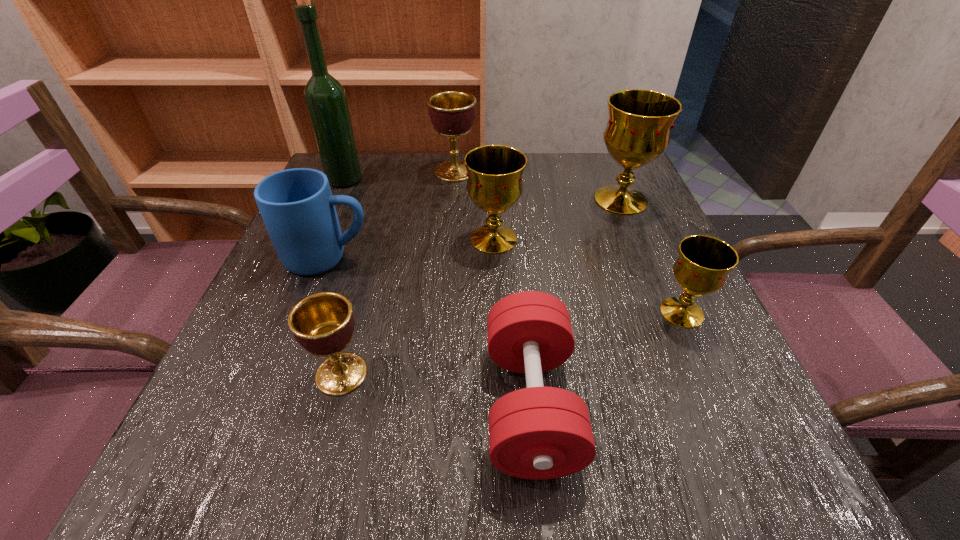
Locate an element on the screen. The height and width of the screenshot is (540, 960). the fourth farthest chalice is located at coordinates (703, 264).

The image size is (960, 540). Identify the location of the left golden chalice. (322, 323).

Image resolution: width=960 pixels, height=540 pixels. Find the location of `the nearer golden chalice`. the nearer golden chalice is located at coordinates (322, 323).

This screenshot has width=960, height=540. Identify the location of dumbbell. (537, 433).

Where is `free space located on the front of the tallest object`? The width and height of the screenshot is (960, 540). free space located on the front of the tallest object is located at coordinates (333, 206).

Locate an element on the screen. The image size is (960, 540). vacant area located on the left of the seventh shortest object is located at coordinates click(537, 200).

At what (x,y) coordinates should I click in order to perform the action: click on vacant region located on the right of the farthest chalice. Please return your answer as a coordinate pair (x, y). Looking at the image, I should click on (629, 171).

In order to click on free region located 0.350m on the front of the second smallest gold chalice in this screenshot , I will do `click(500, 422)`.

What are the coordinates of `vacant region located 0.170m on the side of the blue mug with the handle` in the screenshot? It's located at [x=460, y=258].

At what (x,y) coordinates should I click in order to perform the action: click on free location located 0.390m on the back of the second nearest chalice. Please return your answer as a coordinate pair (x, y). Looking at the image, I should click on pyautogui.click(x=622, y=180).